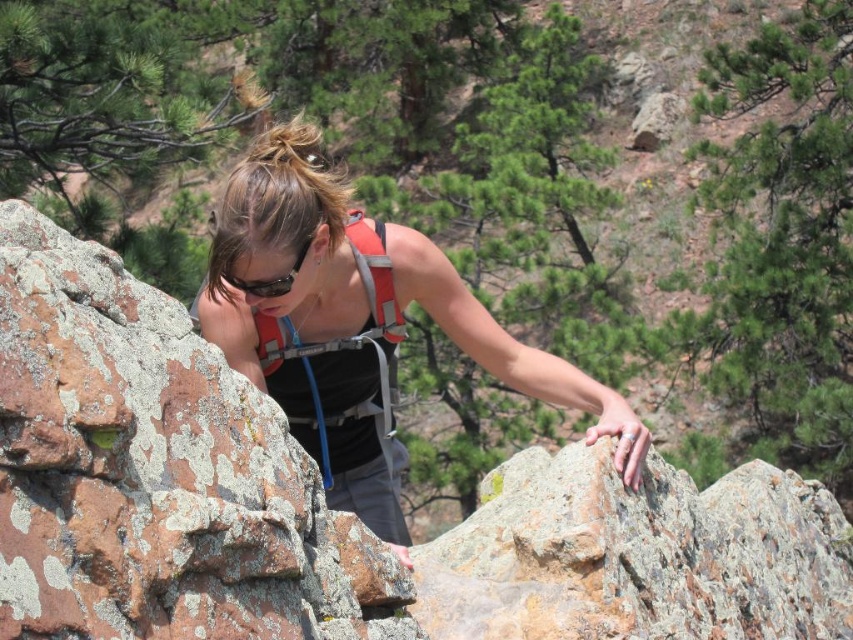
You are a safety inspector checking the gear of a rock climber. You notice the orange fabric vest at center and the black matte sunglasses at center. Which item has a greater width?

The orange fabric vest at center has a greater width than the black matte sunglasses at center.

You are a rock climber who needs to choose between placing your hand on the rusty rock at center or the orange fabric vest at center for support. Which object is bigger and would provide a more stable grip?

The rusty rock at center has a larger size compared to the orange fabric vest at center, so it would provide a more stable grip.